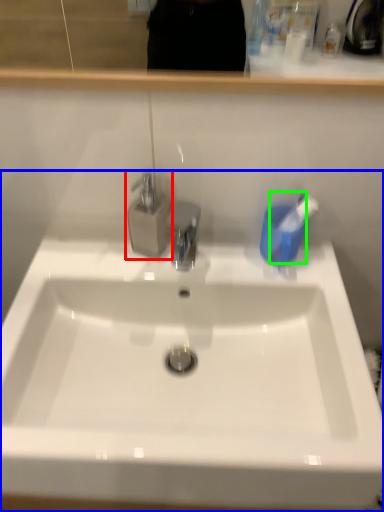
Question: Based on their relative distances, which object is nearer to tap (highlighted by a red box)? Choose from sink (highlighted by a blue box) and toothbrush (highlighted by a green box).

Choices:
 (A) sink
 (B) toothbrush

Answer: (B)